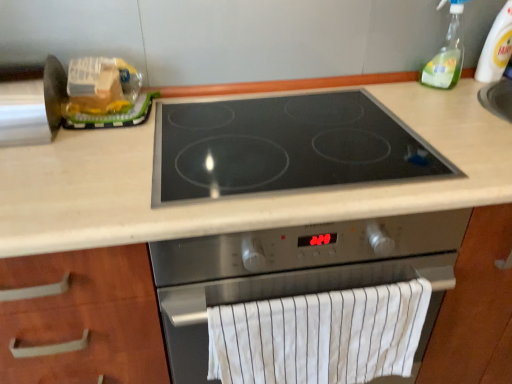
Question: Is translucent plastic bag at upper left surrounded by clear plastic bottle at upper right?

Choices:
 (A) yes
 (B) no

Answer: (B)

Question: Is clear plastic bottle at upper right placed right next to translucent plastic bag at upper left?

Choices:
 (A) yes
 (B) no

Answer: (B)

Question: Can you confirm if clear plastic bottle at upper right is shorter than translucent plastic bag at upper left?

Choices:
 (A) no
 (B) yes

Answer: (A)

Question: Is clear plastic bottle at upper right thinner than translucent plastic bag at upper left?

Choices:
 (A) no
 (B) yes

Answer: (B)

Question: From the image's perspective, is clear plastic bottle at upper right below translucent plastic bag at upper left?

Choices:
 (A) no
 (B) yes

Answer: (A)

Question: Considering the relative sizes of clear plastic bottle at upper right and translucent plastic bag at upper left in the image provided, is clear plastic bottle at upper right wider than translucent plastic bag at upper left?

Choices:
 (A) no
 (B) yes

Answer: (A)

Question: Is black glass cooktop at center at the right side of clear plastic bottle at upper right?

Choices:
 (A) no
 (B) yes

Answer: (A)

Question: Is black glass cooktop at center in front of clear plastic bottle at upper right?

Choices:
 (A) no
 (B) yes

Answer: (B)

Question: From a real-world perspective, is black glass cooktop at center located beneath clear plastic bottle at upper right?

Choices:
 (A) no
 (B) yes

Answer: (B)

Question: From the image's perspective, is black glass cooktop at center over clear plastic bottle at upper right?

Choices:
 (A) no
 (B) yes

Answer: (A)

Question: From the image's perspective, is black glass cooktop at center beneath clear plastic bottle at upper right?

Choices:
 (A) no
 (B) yes

Answer: (B)

Question: Is black glass cooktop at center in contact with clear plastic bottle at upper right?

Choices:
 (A) no
 (B) yes

Answer: (A)

Question: Can you confirm if translucent plastic bag at upper left is wider than stainless steel cooktop at center?

Choices:
 (A) yes
 (B) no

Answer: (B)